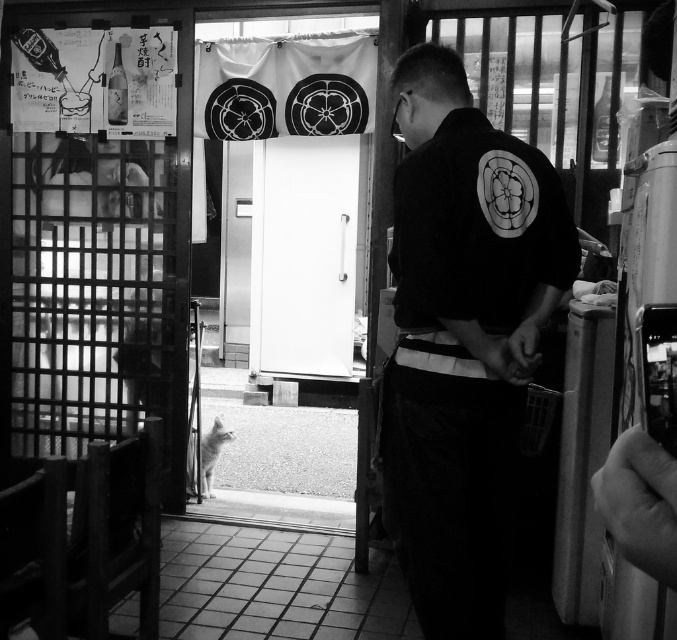
Question: Which point is closer to the camera?

Choices:
 (A) (431, 317)
 (B) (343, 342)

Answer: (A)

Question: Can you confirm if black cotton shirt at center is bigger than white smooth door at center?

Choices:
 (A) yes
 (B) no

Answer: (B)

Question: Which of the following is the farthest from the observer?

Choices:
 (A) white smooth door at center
 (B) black cotton shirt at center

Answer: (A)

Question: Can you confirm if black cotton shirt at center is positioned below white smooth door at center?

Choices:
 (A) yes
 (B) no

Answer: (A)

Question: Is black cotton shirt at center smaller than white smooth door at center?

Choices:
 (A) no
 (B) yes

Answer: (B)

Question: Which point appears farthest from the camera in this image?

Choices:
 (A) (309, 188)
 (B) (552, 296)

Answer: (A)